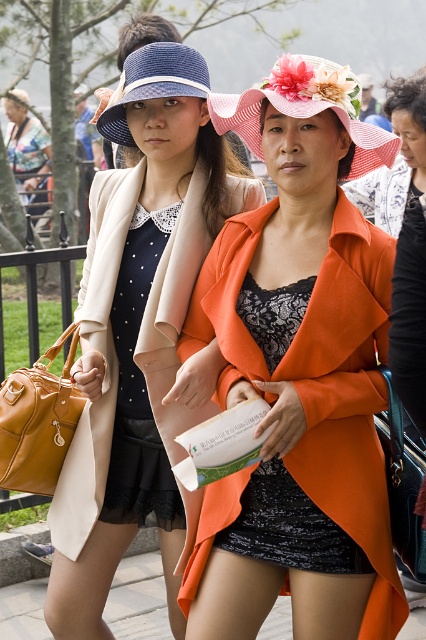
Question: Is pink straw hat at center wider than floral fabric hat at center?

Choices:
 (A) yes
 (B) no

Answer: (A)

Question: Which object appears closest to the camera in this image?

Choices:
 (A) orange matte coat at center
 (B) floral fabric hat at center
 (C) blue woven hat at upper center

Answer: (A)

Question: Which of the following is the closest to the observer?

Choices:
 (A) matte black dress at upper left
 (B) matte black dress at left
 (C) black lace dress at center

Answer: (C)

Question: Is orange matte coat at center positioned behind matte black dress at upper left?

Choices:
 (A) yes
 (B) no

Answer: (B)

Question: Which point appears closest to the camera in this image?

Choices:
 (A) 371,132
 (B) 77,456

Answer: (A)

Question: Can you confirm if orange matte coat at center is wider than matte black dress at left?

Choices:
 (A) yes
 (B) no

Answer: (A)